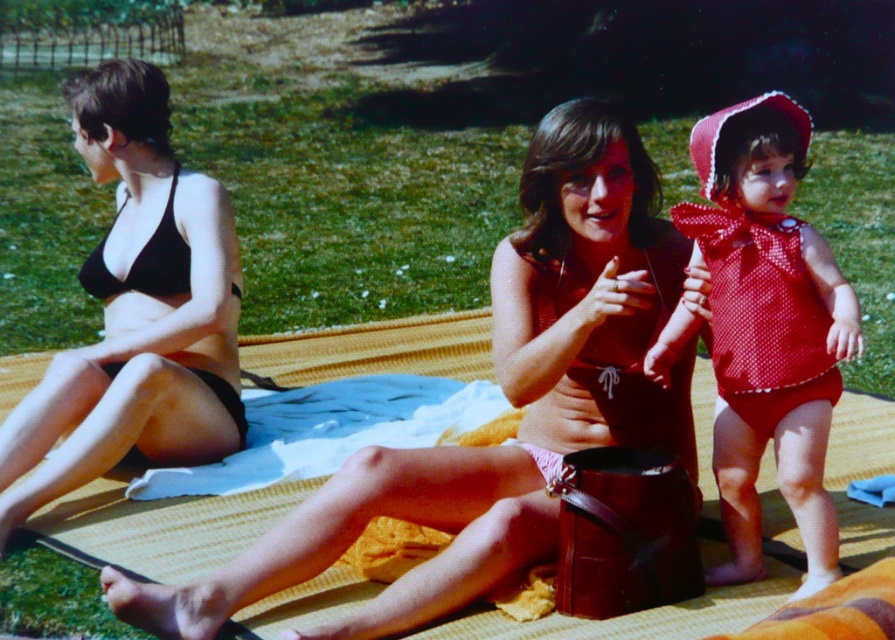
Is polka dot fabric swimsuit at center thinner than matte red swimsuit at center?

No, polka dot fabric swimsuit at center is not thinner than matte red swimsuit at center.

I want to click on polka dot fabric swimsuit at center, so click(768, 339).

Find the location of `polka dot fabric swimsuit at center`. polka dot fabric swimsuit at center is located at coordinates (768, 339).

Measure the distance between point (x=732, y=362) and camera.

They are 4.74 meters apart.

Measure the distance between polka dot fabric swimsuit at center and camera.

A distance of 4.22 meters exists between polka dot fabric swimsuit at center and camera.

The width and height of the screenshot is (895, 640). Identify the location of polka dot fabric swimsuit at center. [768, 339].

Which is below, black matte bikini top at upper left or smooth skin face at center?

black matte bikini top at upper left

Is black matte bikini top at upper left further to camera compared to smooth skin face at center?

Yes, it is behind smooth skin face at center.

Image resolution: width=895 pixels, height=640 pixels. I want to click on black matte bikini top at upper left, so click(137, 316).

Locate an element on the screen. Image resolution: width=895 pixels, height=640 pixels. black matte bikini top at upper left is located at coordinates (137, 316).